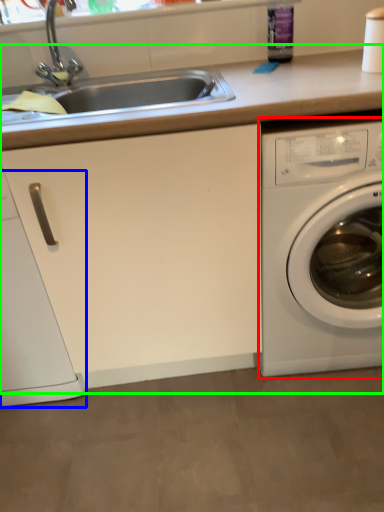
Question: Considering the real-world distances, which object is farthest from washing machine (highlighted by a red box)? dish washer (highlighted by a blue box) or counter top (highlighted by a green box)?

Choices:
 (A) dish washer
 (B) counter top

Answer: (A)